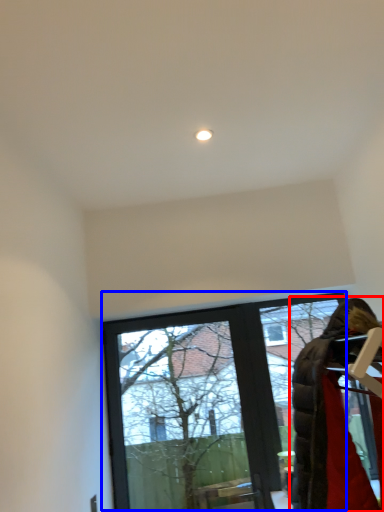
Question: Which of the following is the farthest to the observer, woman (highlighted by a red box) or window (highlighted by a blue box)?

Choices:
 (A) woman
 (B) window

Answer: (B)